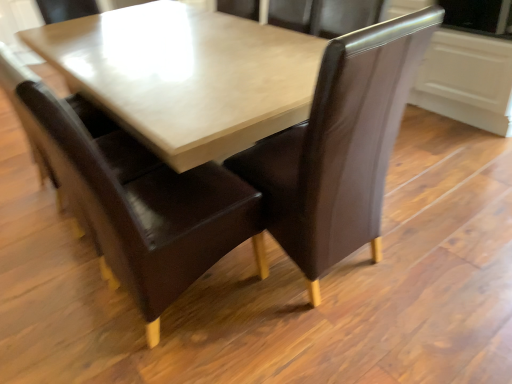
Where is `free space in front of brown leather chair at center, which appears as the second chair when viewed from the left`? The image size is (512, 384). free space in front of brown leather chair at center, which appears as the second chair when viewed from the left is located at coordinates (334, 340).